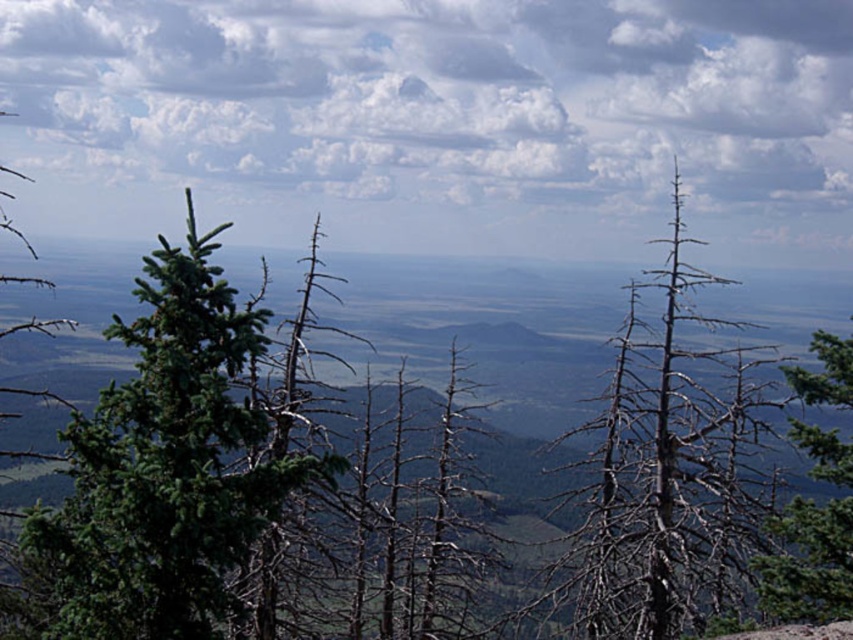
Is point (195, 401) positioned behind point (767, 589)?

That is False.

Which is behind, point (62, 536) or point (828, 474)?

The point (828, 474) is more distant.

Is point (200, 611) positioned in front of point (787, 602)?

Yes, point (200, 611) is in front of point (787, 602).

The width and height of the screenshot is (853, 640). I want to click on green matte evergreen tree at left, so click(166, 467).

Who is more distant from viewer, (178, 561) or (701, 243)?

Positioned behind is point (701, 243).

From the picture: Who is positioned more to the left, green matte evergreen tree at left or dead wood tree at center?

green matte evergreen tree at left is more to the left.

Who is more distant from viewer, (115, 388) or (611, 541)?

Positioned behind is point (611, 541).

Where is `green matte evergreen tree at left`? Image resolution: width=853 pixels, height=640 pixels. green matte evergreen tree at left is located at coordinates (166, 467).

Which of these two, dead wood tree at center or green matte tree at right, stands taller?

dead wood tree at center is taller.

Who is positioned more to the left, dead wood tree at center or green matte tree at right?

dead wood tree at center

Between point (650, 589) and point (804, 435), which one is positioned in front?

Point (804, 435) is more forward.

Where is `dead wood tree at center`? The image size is (853, 640). dead wood tree at center is located at coordinates pos(663,474).